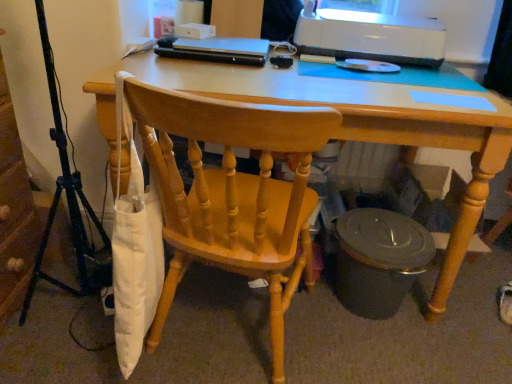
Locate an element on the screen. vacant area that is in front of matte black trash can at lower right is located at coordinates (383, 353).